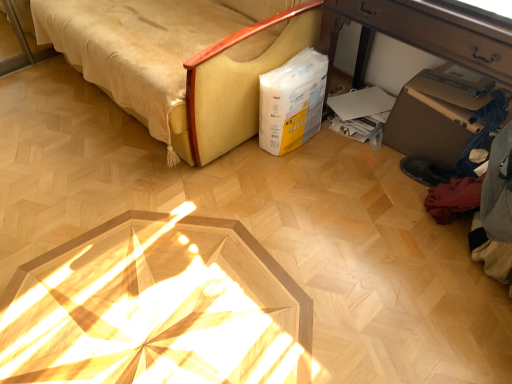
The image size is (512, 384). What are the coordinates of `free location in front of white paper bag at center-right` in the screenshot? It's located at (294, 169).